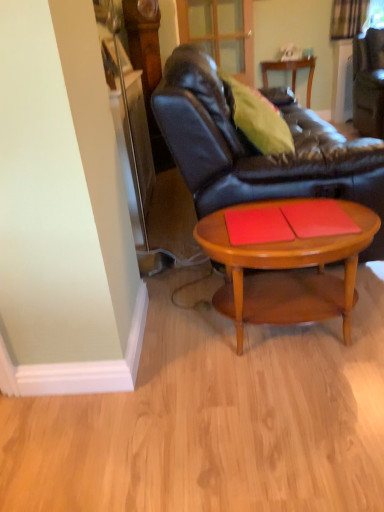
Find the location of `free space below light brown wood coffee table at center (from a real-world perspective)`. free space below light brown wood coffee table at center (from a real-world perspective) is located at coordinates (283, 341).